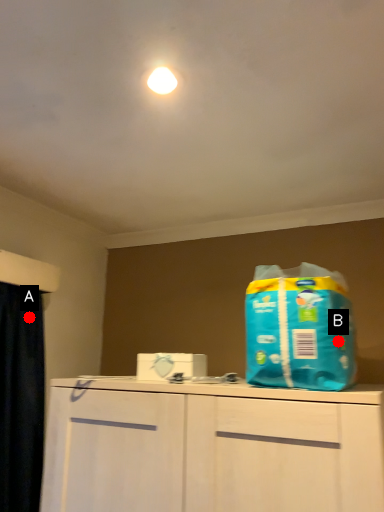
Question: Two points are circled on the image, labeled by A and B beside each circle. Which point appears closest to the camera in this image?

Choices:
 (A) A is closer
 (B) B is closer

Answer: (B)